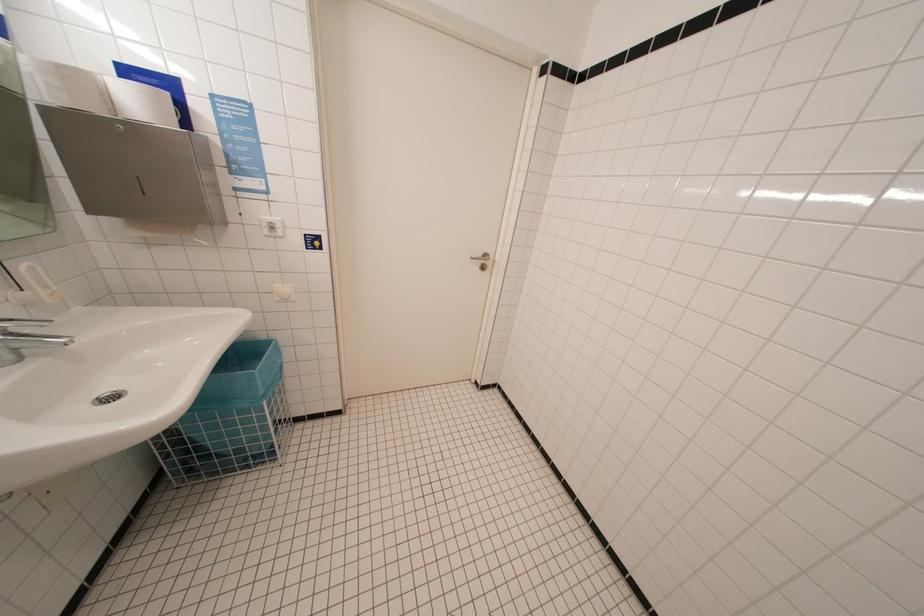
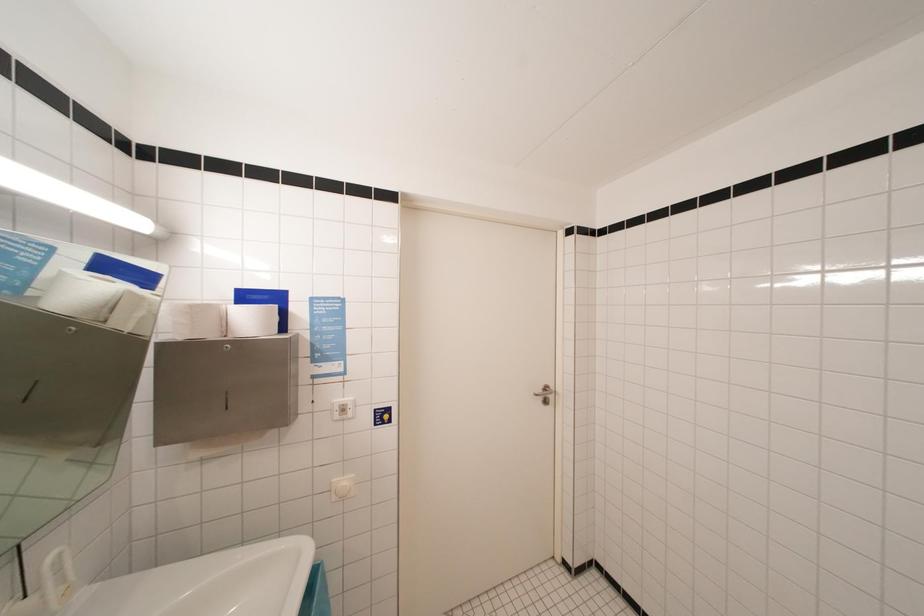
Question: In a continuous first-person perspective shot, in which direction is the camera moving?

Choices:
 (A) Left
 (B) Right
 (C) Forward
 (D) Backward

Answer: (A)